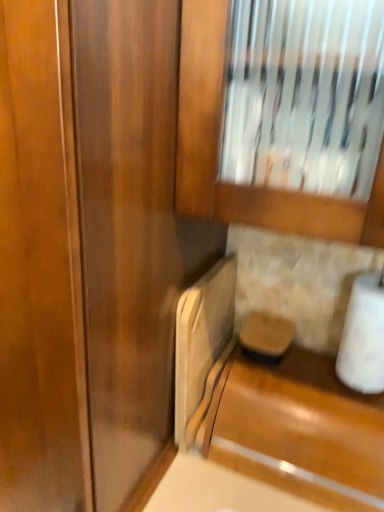
Question: Is white matte toilet paper at lower right to the left or to the right of glossy wood cabinet at lower right in the image?

Choices:
 (A) left
 (B) right

Answer: (B)

Question: Do you think white matte toilet paper at lower right is within glossy wood cabinet at lower right, or outside of it?

Choices:
 (A) outside
 (B) inside

Answer: (A)

Question: From a real-world perspective, relative to glossy wood cabinet at lower right, is white matte toilet paper at lower right vertically above or below?

Choices:
 (A) above
 (B) below

Answer: (A)

Question: Do you think glossy wood cabinet at lower right is within white matte toilet paper at lower right, or outside of it?

Choices:
 (A) outside
 (B) inside

Answer: (A)

Question: From a real-world perspective, is glossy wood cabinet at lower right above or below white matte toilet paper at lower right?

Choices:
 (A) below
 (B) above

Answer: (A)

Question: In terms of width, does glossy wood cabinet at lower right look wider or thinner when compared to white matte toilet paper at lower right?

Choices:
 (A) wide
 (B) thin

Answer: (A)

Question: Is point pos(226,375) positioned closer to the camera than point pos(382,304)?

Choices:
 (A) closer
 (B) farther

Answer: (B)